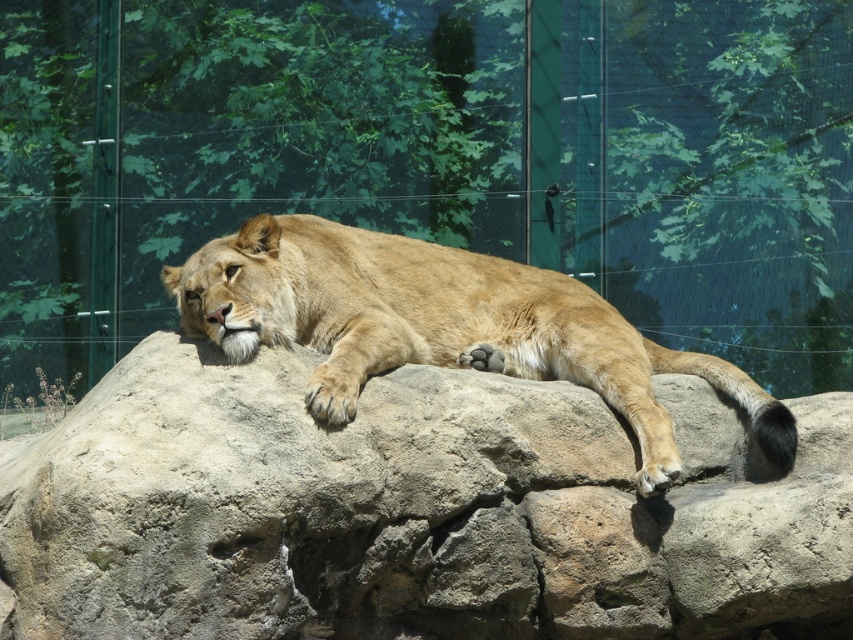
Based on the photo, you are a wildlife photographer aiming to capture the golden fur lion at center in your shot. You want to ensure the smooth rock at center appears to the left of the lion in the photo. Based on the scene, is this possible?

The smooth rock at center is to the right of the golden fur lion at center, so arranging the shot to have the smooth rock at center appear to the left of the golden fur lion at center is not possible as their positions are fixed in the scene.